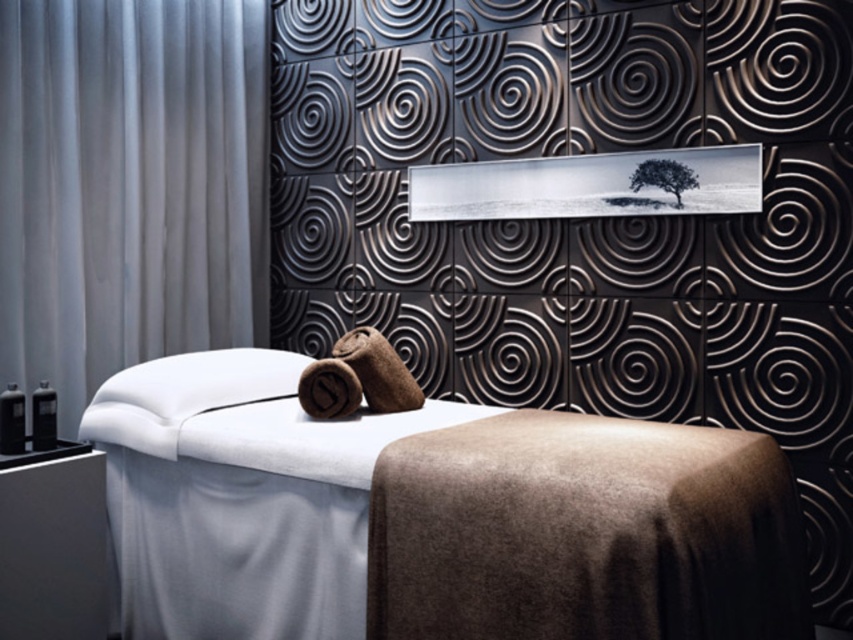
Between point (167, 616) and point (364, 365), which one is positioned in front?

Point (167, 616) is more forward.

Identify the location of white fabric bed at center. [x=432, y=516].

This screenshot has width=853, height=640. What do you see at coordinates (129, 186) in the screenshot? I see `white fabric curtain at left` at bounding box center [129, 186].

Measure the distance between white fabric curtain at left and camera.

white fabric curtain at left and camera are 9.54 feet apart from each other.

The width and height of the screenshot is (853, 640). I want to click on white fabric curtain at left, so click(129, 186).

Can you confirm if white fabric bed at center is positioned below white fabric curtain at left?

Yes, white fabric bed at center is below white fabric curtain at left.

Is point (514, 456) positioned in front of point (149, 132)?

Yes, it is.

At what (x,y) coordinates should I click in order to perform the action: click on white fabric bed at center. Please return your answer as a coordinate pair (x, y). This screenshot has height=640, width=853. Looking at the image, I should click on (432, 516).